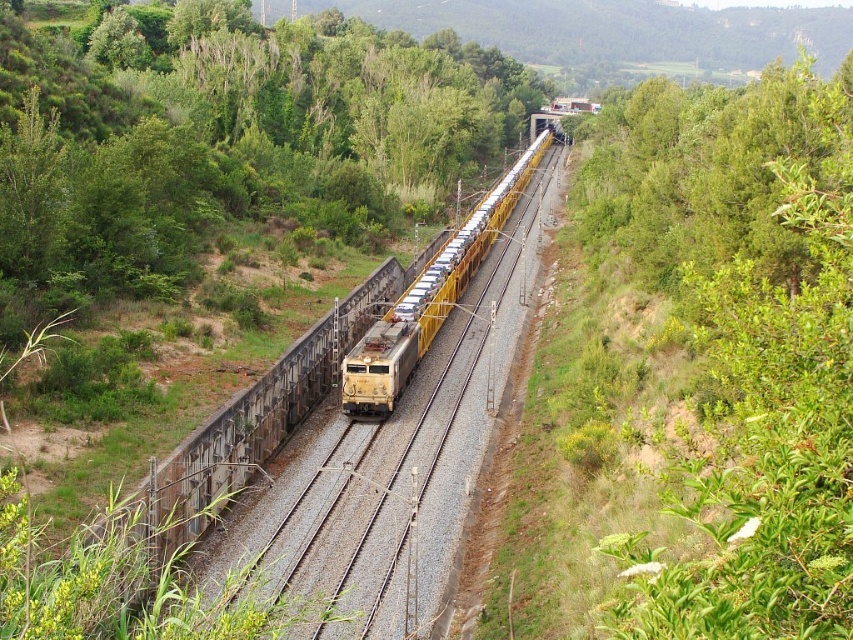
Does yellow metal train tracks at center appear over yellow metallic locomotive at center?

Yes.

Does yellow metal train tracks at center come in front of yellow metallic locomotive at center?

That is True.

Does point (486, 346) come farther from viewer compared to point (403, 352)?

Yes, point (486, 346) is behind point (403, 352).

Image resolution: width=853 pixels, height=640 pixels. In order to click on yellow metal train tracks at center in this screenshot , I will do [x=393, y=464].

Can you confirm if yellow metal train tracks at center is positioned to the left of yellow metallic train at center?

Correct, you'll find yellow metal train tracks at center to the left of yellow metallic train at center.

How much distance is there between yellow metal train tracks at center and yellow metallic train at center?

They are 7.89 meters apart.

This screenshot has height=640, width=853. Find the location of `yellow metal train tracks at center`. yellow metal train tracks at center is located at coordinates (393, 464).

Where is `yellow metal train tracks at center`? yellow metal train tracks at center is located at coordinates (393, 464).

Is yellow metallic train at center above yellow metallic locomotive at center?

Yes.

Is yellow metallic train at center positioned in front of yellow metallic locomotive at center?

No, it is behind yellow metallic locomotive at center.

Is point (387, 403) more distant than point (387, 374)?

Yes, point (387, 403) is farther from viewer.

Find the location of `yellow metallic train at center`. yellow metallic train at center is located at coordinates (428, 298).